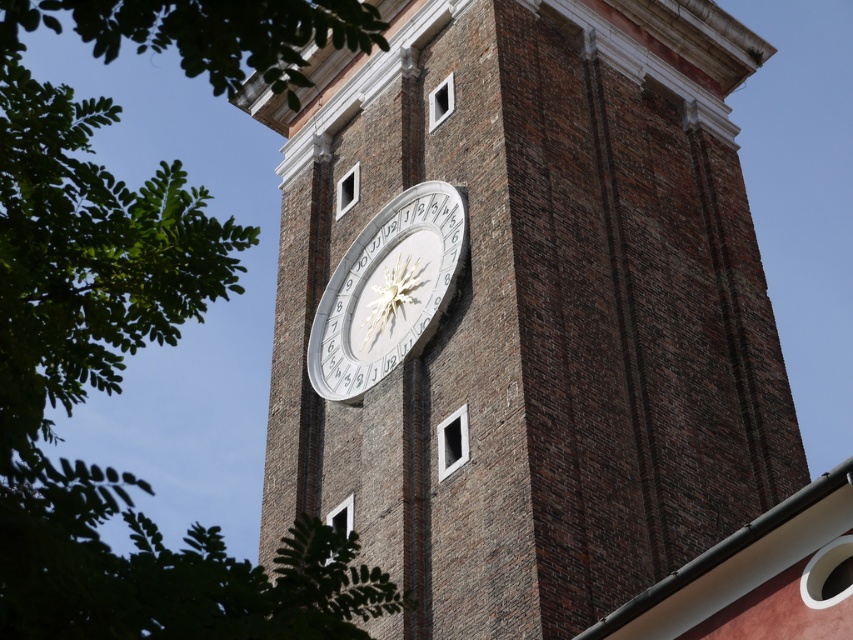
Based on the photo, can you confirm if green leafy tree at upper left is thinner than white metallic clock at center?

No, green leafy tree at upper left is not thinner than white metallic clock at center.

Can you confirm if green leafy tree at upper left is bigger than white metallic clock at center?

Yes, green leafy tree at upper left is bigger than white metallic clock at center.

Which is behind, point (106, 381) or point (415, 330)?

Point (415, 330)

Image resolution: width=853 pixels, height=640 pixels. I want to click on green leafy tree at upper left, so click(x=136, y=333).

Based on the photo, is brown brick clock at center shorter than white metallic clock at center?

No, brown brick clock at center is not shorter than white metallic clock at center.

Who is more forward, (541,467) or (463,205)?

Positioned in front is point (541,467).

The image size is (853, 640). What are the coordinates of `brown brick clock at center` in the screenshot? It's located at (523, 307).

Does point (492, 588) come farther from viewer compared to point (105, 355)?

Yes.

The width and height of the screenshot is (853, 640). What do you see at coordinates (523, 307) in the screenshot?
I see `brown brick clock at center` at bounding box center [523, 307].

Image resolution: width=853 pixels, height=640 pixels. Describe the element at coordinates (523, 307) in the screenshot. I see `brown brick clock at center` at that location.

Identify the location of brown brick clock at center. The height and width of the screenshot is (640, 853). (523, 307).